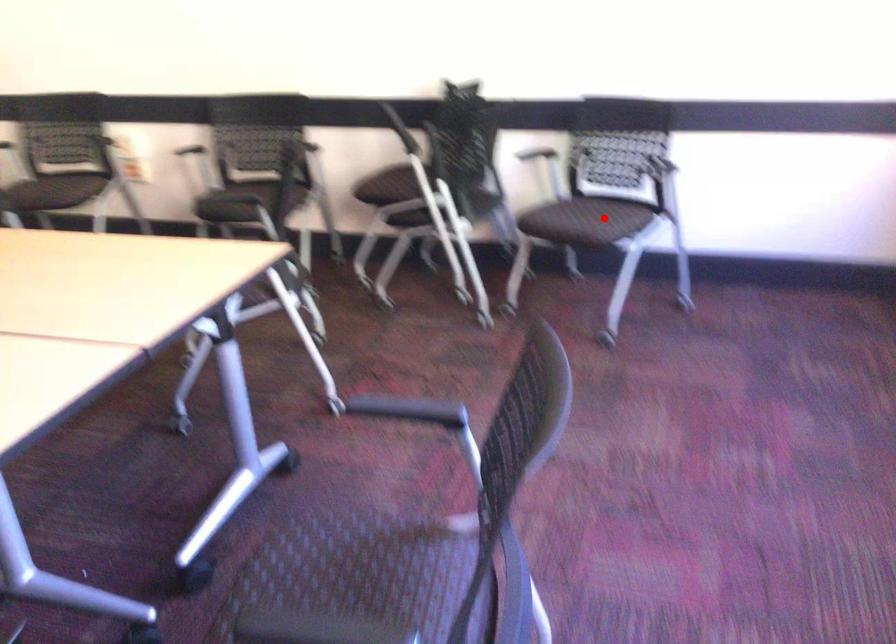
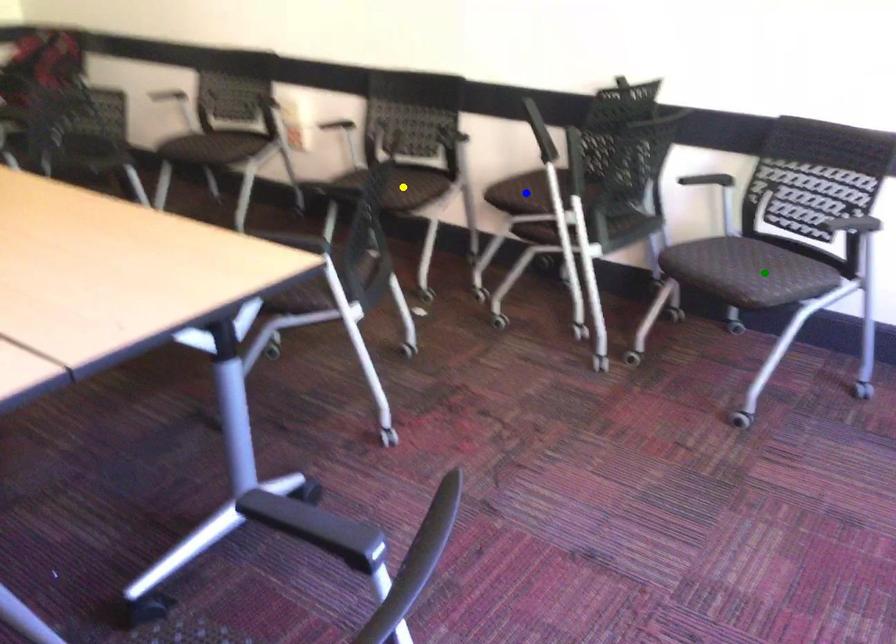
Question: I am providing you with two images of the same scene from different viewpoints. A red point is marked on the first image. You are given multiple points on the second image. Which spot in image 2 lines up with the point in image 1?

Choices:
 (A) blue point
 (B) yellow point
 (C) green point

Answer: (C)